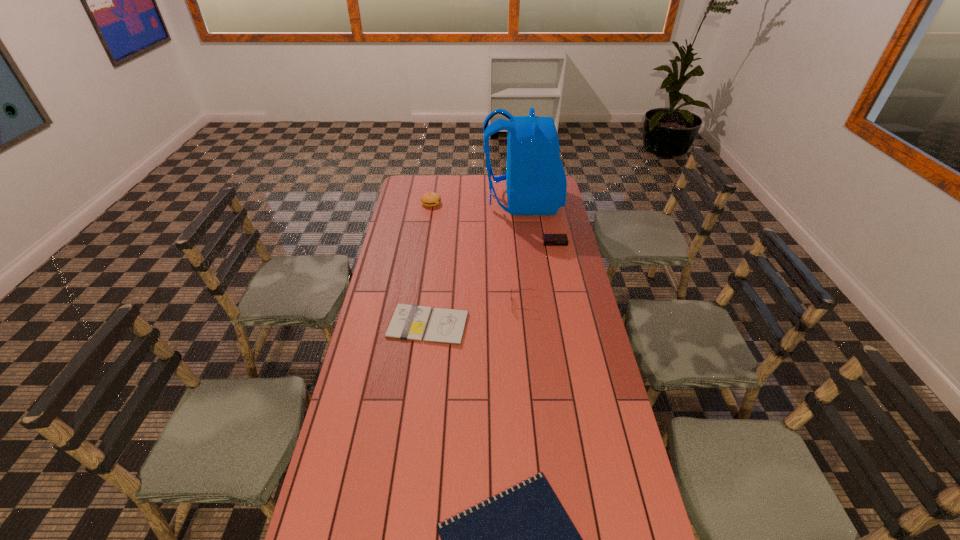
This screenshot has height=540, width=960. In order to click on vacant position located on the back of the fifth shortest object in this screenshot , I will do `click(435, 179)`.

What are the coordinates of `free spot located on the temples of the spectacles` in the screenshot? It's located at (494, 304).

Locate an element on the screen. The height and width of the screenshot is (540, 960). blank space located 0.360m on the temples of the spectacles is located at coordinates (418, 304).

You are a GUI agent. You are given a task and a screenshot of the screen. Output one action in this format:
    pyautogui.click(x=<x>, y=<y>)
    Task: Click on the blank space located on the temples of the spectacles
    The width and height of the screenshot is (960, 540).
    Given the screenshot: What is the action you would take?
    pyautogui.click(x=416, y=304)

The width and height of the screenshot is (960, 540). Identify the location of vacant area situated 0.330m on the front face of the alarm clock. (566, 295).

The width and height of the screenshot is (960, 540). I want to click on free space located on the front of the fifth tallest object, so pyautogui.click(x=421, y=382).

Find the location of a particular element. The height and width of the screenshot is (540, 960). object present at the far edge is located at coordinates (536, 183).

Where is `patty that is at the left edge`? Image resolution: width=960 pixels, height=540 pixels. patty that is at the left edge is located at coordinates pos(429,199).

Find the location of `notepad at the left edge`. notepad at the left edge is located at coordinates (409, 322).

This screenshot has width=960, height=540. In order to click on backpack present at the right edge in this screenshot , I will do `click(536, 183)`.